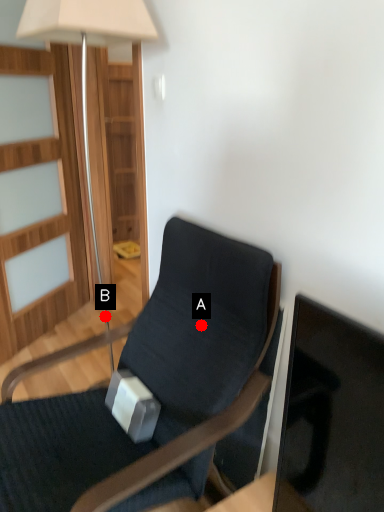
Question: Two points are circled on the image, labeled by A and B beside each circle. Which point is farther to the camera?

Choices:
 (A) A is further
 (B) B is further

Answer: (B)